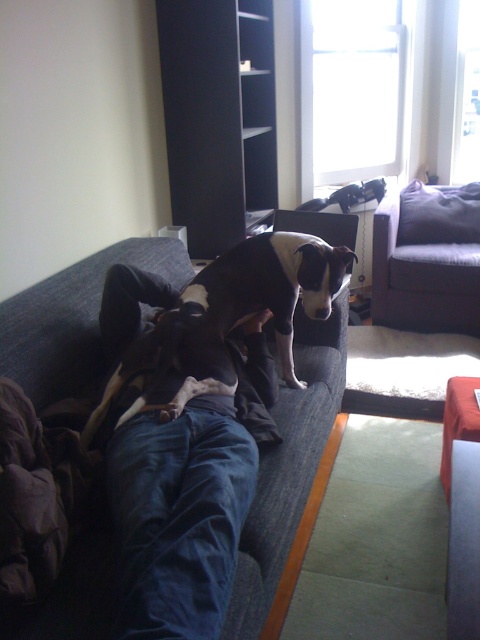
Question: Can you confirm if black and white fur dog at center is wider than dark gray fabric couch at upper right?

Choices:
 (A) no
 (B) yes

Answer: (B)

Question: Which point appears closest to the camera in this image?

Choices:
 (A) pyautogui.click(x=389, y=307)
 (B) pyautogui.click(x=328, y=253)
 (C) pyautogui.click(x=145, y=417)

Answer: (C)

Question: Can you confirm if blue fabric couch at upper center is positioned to the right of dark gray fabric couch at upper right?

Choices:
 (A) yes
 (B) no

Answer: (B)

Question: Which point is closer to the camera?

Choices:
 (A) dark gray fabric couch at upper right
 (B) black and white fur dog at center

Answer: (B)

Question: Can you confirm if blue fabric couch at upper center is thinner than black and white fur dog at center?

Choices:
 (A) yes
 (B) no

Answer: (B)

Question: Among these points, which one is nearest to the camera?

Choices:
 (A) (243, 280)
 (B) (40, 296)

Answer: (B)